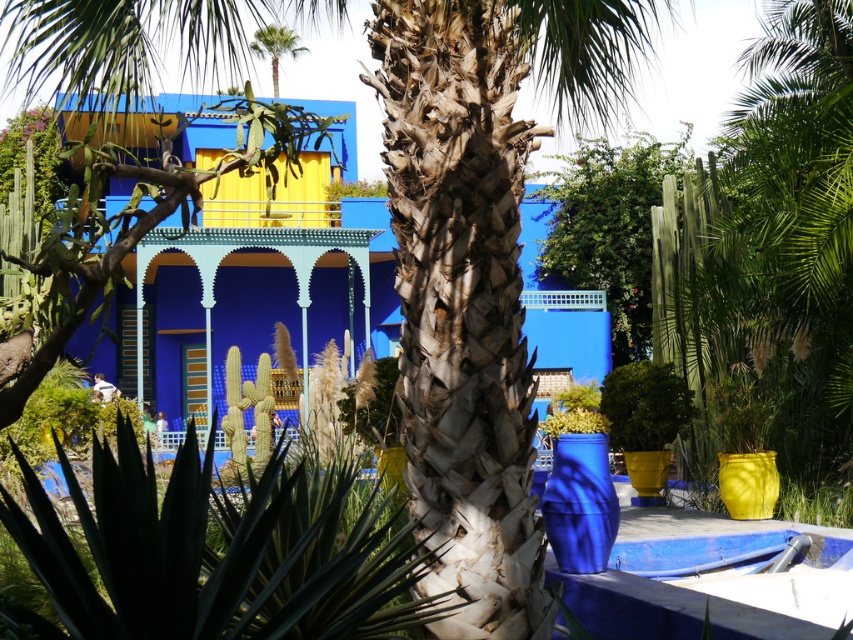
Is blue glossy building at center below green leafy palm tree at upper center?

Indeed, blue glossy building at center is positioned under green leafy palm tree at upper center.

What do you see at coordinates (561, 310) in the screenshot? This screenshot has width=853, height=640. I see `blue glossy building at center` at bounding box center [561, 310].

The width and height of the screenshot is (853, 640). Describe the element at coordinates (561, 310) in the screenshot. I see `blue glossy building at center` at that location.

This screenshot has height=640, width=853. I want to click on blue glossy building at center, so click(x=561, y=310).

Between point (483, 509) and point (248, 220), which one is positioned in front?

Positioned in front is point (483, 509).

Is leathery brown palm trunk at center below blue glossy building at center?

Yes.

Identify the location of leathery brown palm trunk at center. The height and width of the screenshot is (640, 853). (474, 276).

Image resolution: width=853 pixels, height=640 pixels. I want to click on leathery brown palm trunk at center, so click(474, 276).

Which of these two, leathery brown palm trunk at center or green leafy palm tree at upper center, stands shorter?

With less height is leathery brown palm trunk at center.

Who is positioned more to the left, leathery brown palm trunk at center or green leafy palm tree at upper center?

From the viewer's perspective, green leafy palm tree at upper center appears more on the left side.

This screenshot has height=640, width=853. Identify the location of leathery brown palm trunk at center. (474, 276).